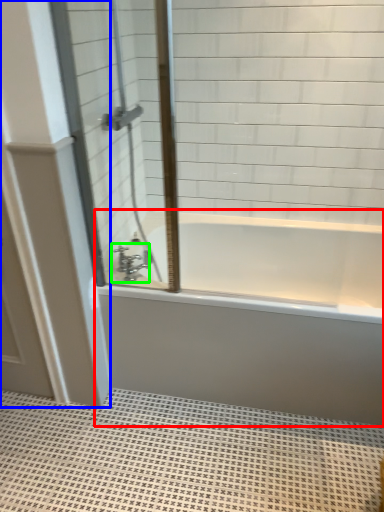
Question: Estimate the real-world distances between objects in this image. Which object is farther from bathtub (highlighted by a red box), door (highlighted by a blue box) or tap (highlighted by a green box)?

Choices:
 (A) door
 (B) tap

Answer: (B)